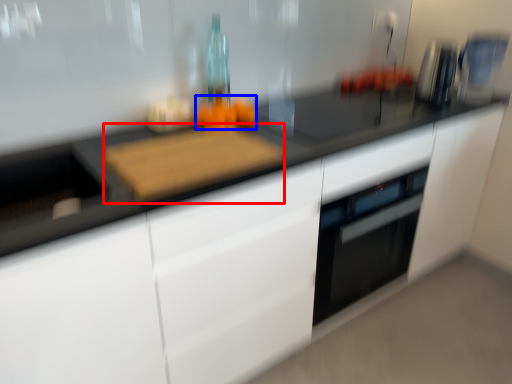
Question: Which object is closer to the camera taking this photo, cutting board (highlighted by a red box) or food (highlighted by a blue box)?

Choices:
 (A) cutting board
 (B) food

Answer: (A)